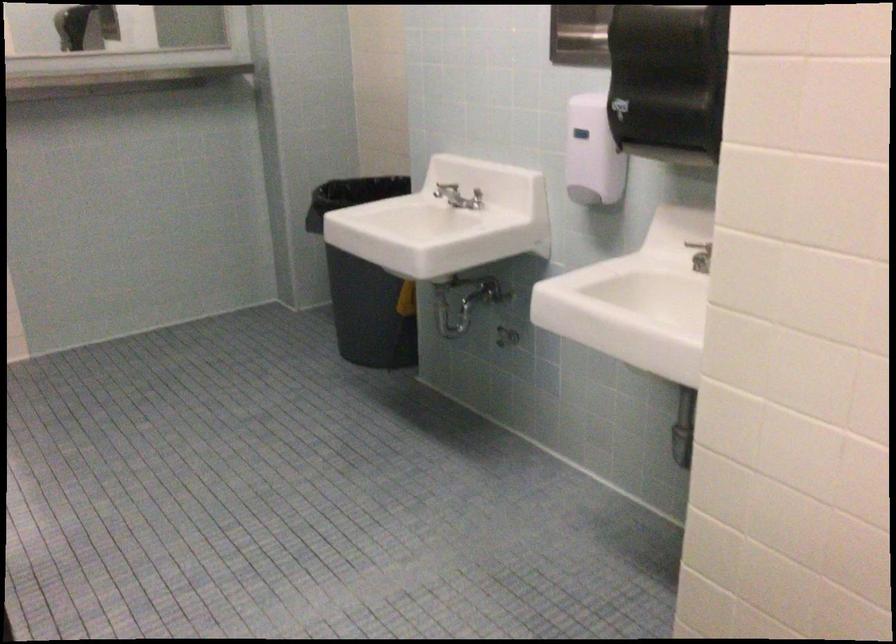
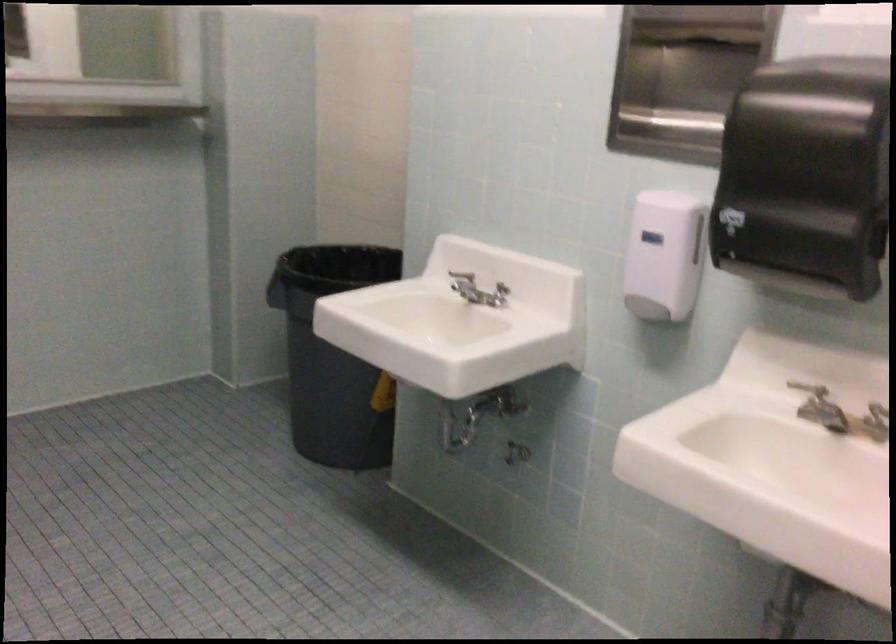
In the second image, find the point that corresponds to the point at 590,198 in the first image.

(653, 310)